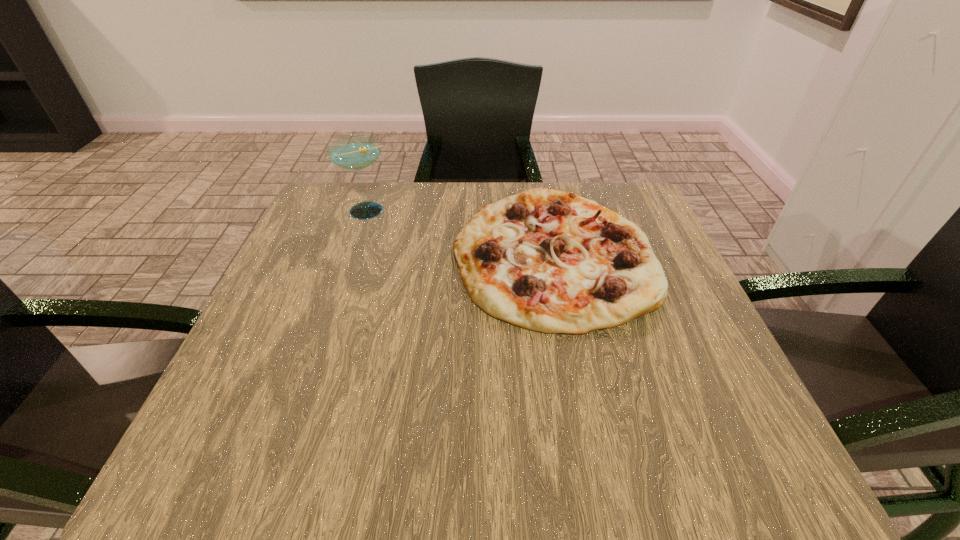
Where is `martini`? The height and width of the screenshot is (540, 960). martini is located at coordinates (356, 152).

Where is `the left object`? the left object is located at coordinates coord(356,152).

You are a GUI agent. You are given a task and a screenshot of the screen. Output one action in this format:
    pyautogui.click(x=<x>, y=<y>)
    Task: Click on the right object
    The width and height of the screenshot is (960, 540).
    Given the screenshot: What is the action you would take?
    coord(548,261)

Identify the location of the shorter object. (548, 261).

I want to click on free spot located 0.350m on the right of the martini, so click(x=536, y=211).

The width and height of the screenshot is (960, 540). I want to click on free spot located 0.180m on the front of the right object, so click(x=587, y=429).

Where is `martini that is at the far edge`? The image size is (960, 540). martini that is at the far edge is located at coordinates (356, 152).

Where is `pizza that is at the far edge`? pizza that is at the far edge is located at coordinates (548, 261).

Identify the location of object that is at the left edge. The height and width of the screenshot is (540, 960). (356, 152).

Identify the location of object located in the right edge section of the desktop. The height and width of the screenshot is (540, 960). (548, 261).